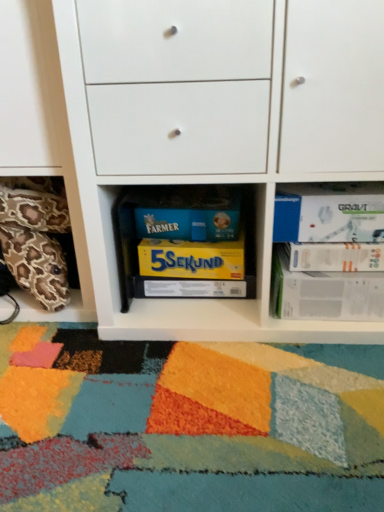
At what (x,y) coordinates should I click in order to perform the action: click on empty space that is ontop of leopard print pillow at lower left (from a real-world perspective). Please return your answer as a coordinate pair (x, y). This screenshot has width=384, height=512. Looking at the image, I should click on (29, 230).